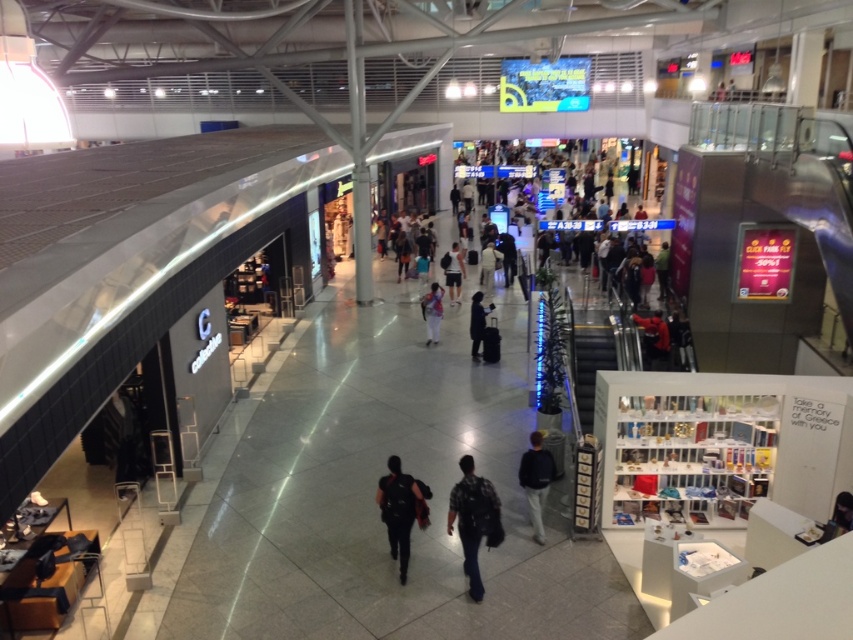
Question: Which object is the closest to the dark blue sweater at center?

Choices:
 (A) dark gray backpack at center
 (B) dark blue jeans at center
 (C) dark blue fabric jacket at center
 (D) red leather jacket at center

Answer: (A)

Question: Does dark blue sweater at center appear on the left side of red leather jacket at center?

Choices:
 (A) yes
 (B) no

Answer: (A)

Question: Does dark gray backpack at center appear under denim jacket at center?

Choices:
 (A) yes
 (B) no

Answer: (A)

Question: Can you confirm if denim jacket at center is positioned to the right of dark blue fabric jacket at center?

Choices:
 (A) no
 (B) yes

Answer: (A)

Question: Which of these objects is positioned closest to the plaid shirt at center?

Choices:
 (A) dark gray backpack at center
 (B) dark blue jeans at center
 (C) red leather jacket at center
 (D) dark blue sweater at center

Answer: (A)

Question: Which point appears closest to the camera in this image?

Choices:
 (A) (650, 337)
 (B) (473, 352)
 (C) (450, 300)

Answer: (A)